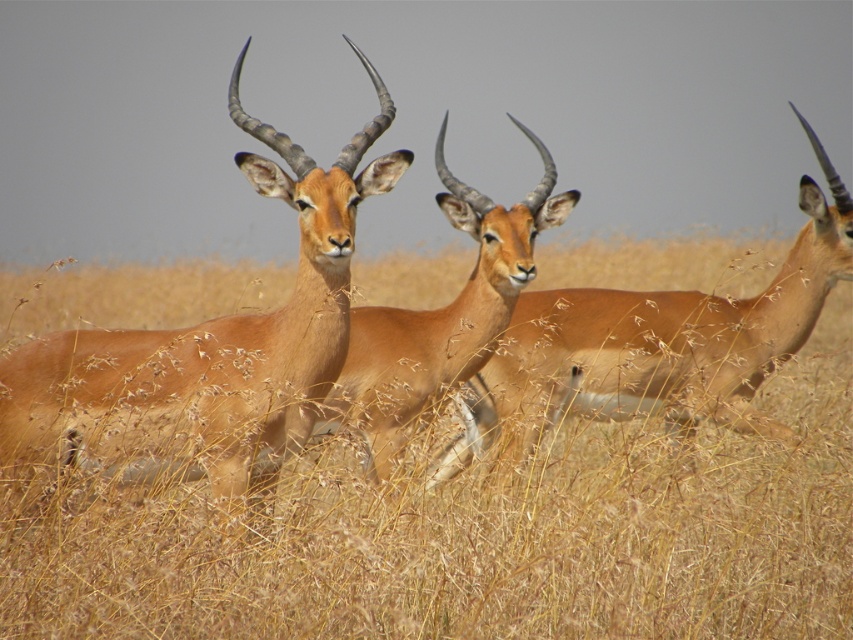
Which is more to the left, brown velvet antelope at center or brown matte/deer at center?

brown velvet antelope at center

Which of these two, brown velvet antelope at center or brown matte/deer at center, stands taller?

brown velvet antelope at center

Does point (22, 349) lie in front of point (360, 426)?

Yes, it is in front of point (360, 426).

What are the coordinates of `brown velvet antelope at center` in the screenshot? It's located at click(x=207, y=346).

Is brown dry grass at center wider than brown glossy antelope at center?

Correct, the width of brown dry grass at center exceeds that of brown glossy antelope at center.

Does point (643, 576) lie behind point (648, 378)?

That is False.

At what (x,y) coordinates should I click in order to perform the action: click on brown dry grass at center. Please return your answer as a coordinate pair (x, y). Looking at the image, I should click on (474, 536).

Which is more to the right, brown dry grass at center or brown velvet antelope at center?

brown dry grass at center

Does brown dry grass at center appear under brown velvet antelope at center?

Indeed, brown dry grass at center is positioned under brown velvet antelope at center.

From the picture: Who is more distant from viewer, (143,609) or (331,241)?

The point (331,241) is behind.

I want to click on brown dry grass at center, so click(x=474, y=536).